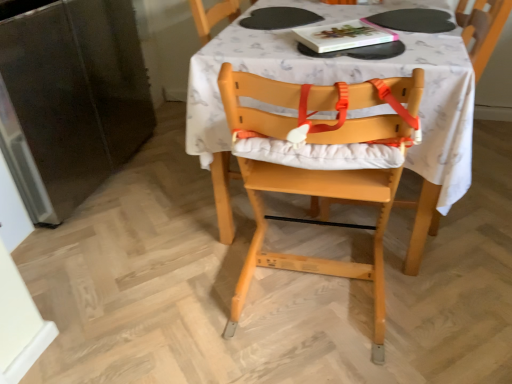
The width and height of the screenshot is (512, 384). Identify the location of vacant point to the right of natural wood highchair at center. (447, 287).